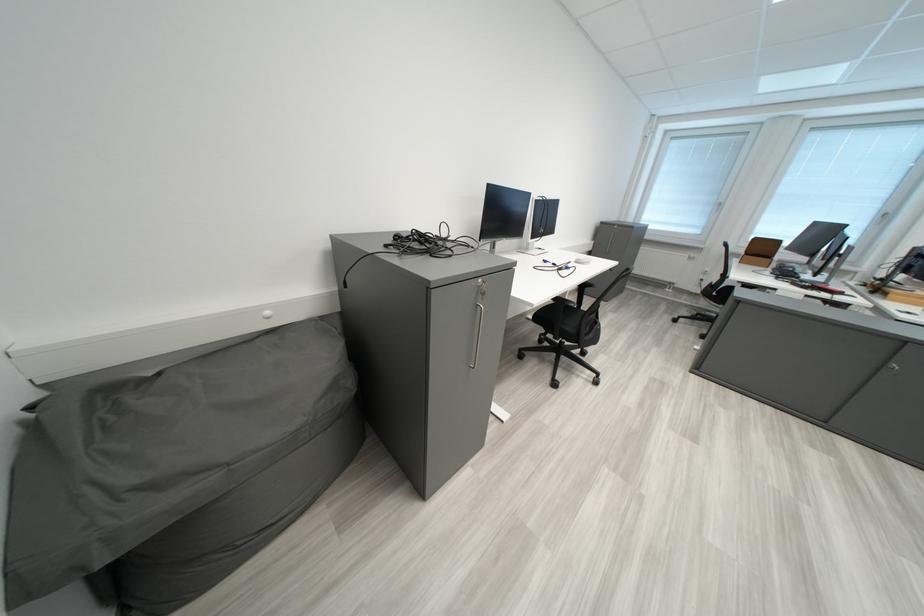
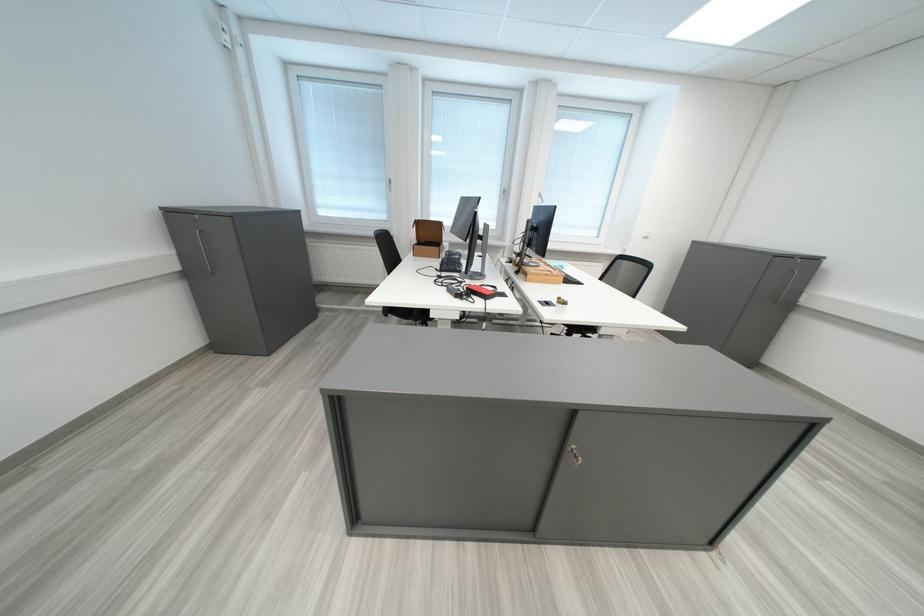
Where in the second image is the point corresponding to pixel 786 267 from the first image?

(456, 256)